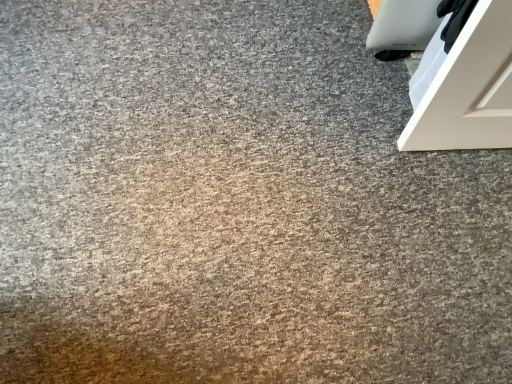
In order to click on white matte door at upper right in this screenshot , I will do `click(469, 88)`.

What do you see at coordinates (469, 88) in the screenshot? I see `white matte door at upper right` at bounding box center [469, 88].

This screenshot has width=512, height=384. In order to click on white matte door at upper right in this screenshot , I will do `click(469, 88)`.